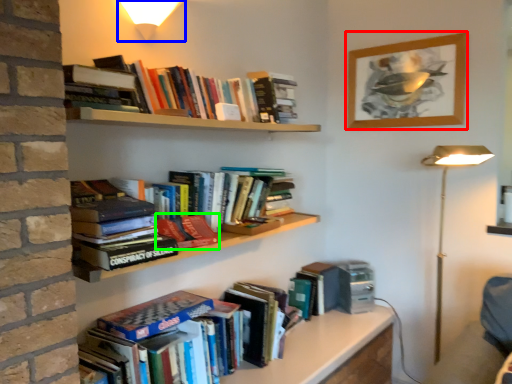
Question: Estimate the real-world distances between objects in this image. Which object is closer to picture frame (highlighted by a red box), light fixture (highlighted by a blue box) or book (highlighted by a green box)?

Choices:
 (A) light fixture
 (B) book

Answer: (A)